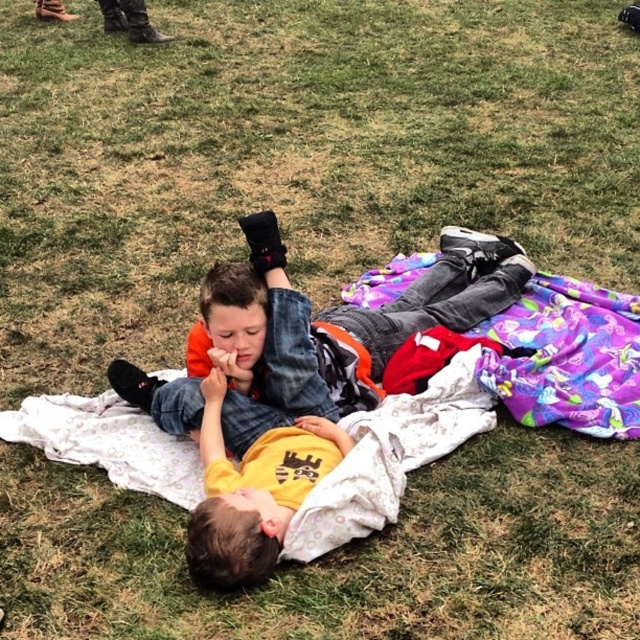
You are a photographer trying to capture a photo of the orange fleece jacket at center and the purple fabric blanket at center. You want to ensure both items are visible in the frame. Based on their positions, which item should you position first in your camera viewfinder to include both?

The orange fleece jacket at center is to the left of the purple fabric blanket at center, so you should position the orange fleece jacket at center first in your camera viewfinder to ensure both items are visible in the frame.

You are a parent looking for your children. You see the orange fleece jacket at center and the purple fabric blanket at center. Which item is larger in size?

The orange fleece jacket at center is bigger than the purple fabric blanket at center.